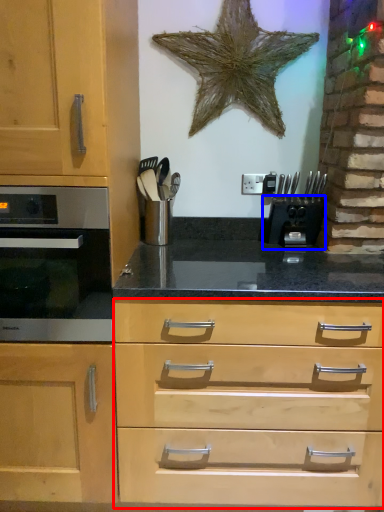
Question: Which object is further to the camera taking this photo, drawer (highlighted by a red box) or coffee machine (highlighted by a blue box)?

Choices:
 (A) drawer
 (B) coffee machine

Answer: (B)